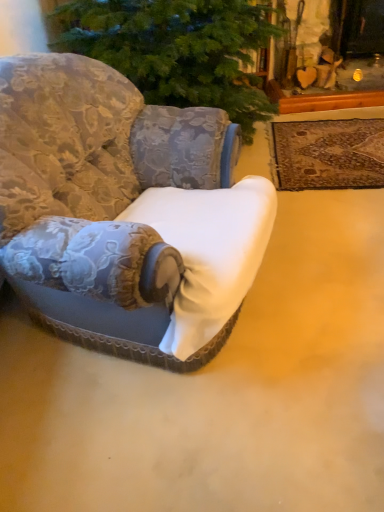
Question: From a real-world perspective, is white fabric chair at center under brown woven rug at upper right?

Choices:
 (A) no
 (B) yes

Answer: (A)

Question: Is white fabric chair at center oriented away from brown woven rug at upper right?

Choices:
 (A) yes
 (B) no

Answer: (B)

Question: From a real-world perspective, is white fabric chair at center on brown woven rug at upper right?

Choices:
 (A) no
 (B) yes

Answer: (B)

Question: Is white fabric chair at center placed right next to brown woven rug at upper right?

Choices:
 (A) no
 (B) yes

Answer: (A)

Question: Is white fabric chair at center at the left side of brown woven rug at upper right?

Choices:
 (A) no
 (B) yes

Answer: (B)

Question: Is brown woven rug at upper right surrounded by white fabric chair at center?

Choices:
 (A) yes
 (B) no

Answer: (B)

Question: Is brown woven rug at upper right outside white fabric chair at center?

Choices:
 (A) no
 (B) yes

Answer: (B)

Question: From a real-world perspective, is brown woven rug at upper right positioned over white fabric chair at center based on gravity?

Choices:
 (A) no
 (B) yes

Answer: (A)

Question: Considering the relative positions of brown woven rug at upper right and white fabric chair at center in the image provided, is brown woven rug at upper right to the left of white fabric chair at center from the viewer's perspective?

Choices:
 (A) yes
 (B) no

Answer: (B)

Question: Would you say brown woven rug at upper right contains white fabric chair at center?

Choices:
 (A) no
 (B) yes

Answer: (A)

Question: Does brown woven rug at upper right have a smaller size compared to white fabric chair at center?

Choices:
 (A) yes
 (B) no

Answer: (A)

Question: Does brown woven rug at upper right have a lesser height compared to white fabric chair at center?

Choices:
 (A) yes
 (B) no

Answer: (A)

Question: From a real-world perspective, relative to white fabric chair at center, is brown woven rug at upper right vertically above or below?

Choices:
 (A) below
 (B) above

Answer: (A)